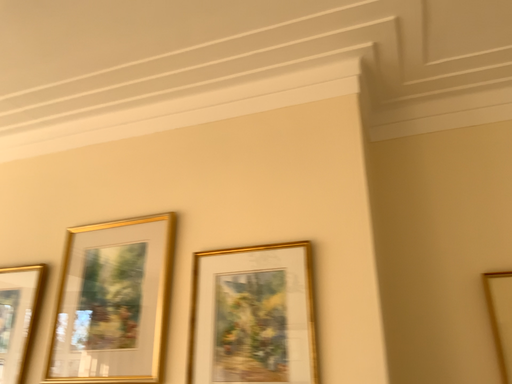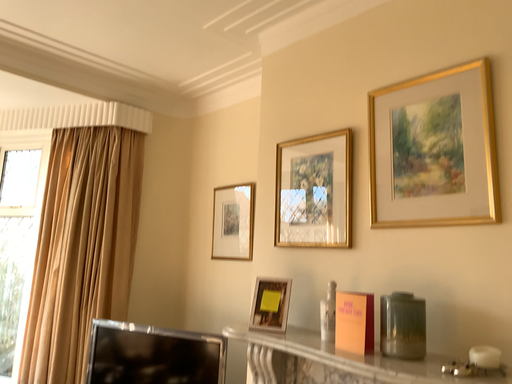
Question: How did the camera likely rotate when shooting the video?

Choices:
 (A) rotated upward
 (B) rotated downward

Answer: (B)